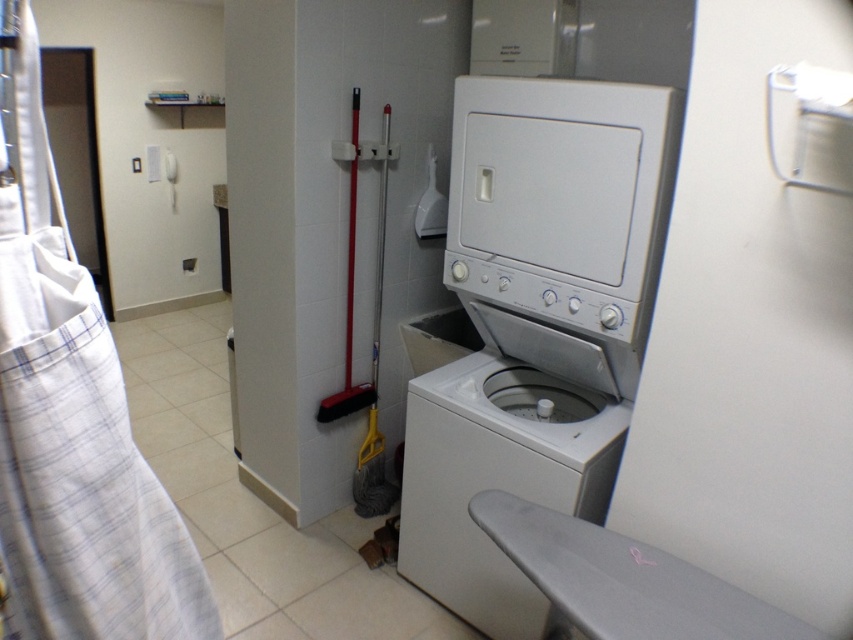
You are moving a white plaid fabric at left and a white plastic washing machine at lower center into a new utility room. Based on their positions in the original image, which object should be placed higher up when setting them up in the new room?

The white plaid fabric at left should be placed higher up since it was positioned above the white plastic washing machine at lower center in the original image.